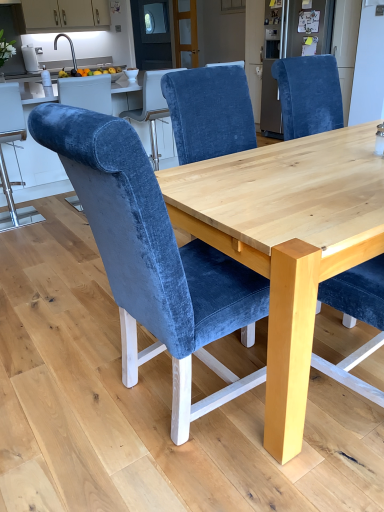
Question: Is velvet blue chair at left, which appears as the 1th chair when viewed from the left, inside velvet blue chair at center, arranged as the second chair when viewed from the right?

Choices:
 (A) no
 (B) yes

Answer: (A)

Question: From a real-world perspective, is velvet blue chair at center, which is the second chair in left-to-right order, under velvet blue chair at left, which is the 1th chair in back-to-front order?

Choices:
 (A) yes
 (B) no

Answer: (B)

Question: Does velvet blue chair at center, arranged as the second chair when viewed from the right, have a smaller size compared to velvet blue chair at left, which appears as the 1th chair when viewed from the left?

Choices:
 (A) no
 (B) yes

Answer: (A)

Question: Is velvet blue chair at center, which is counted as the first chair, starting from the front, facing away from velvet blue chair at left, acting as the third chair starting from the front?

Choices:
 (A) no
 (B) yes

Answer: (A)

Question: Does velvet blue chair at center, arranged as the second chair when viewed from the right, have a greater height compared to velvet blue chair at left, which ranks as the 3th chair in right-to-left order?

Choices:
 (A) no
 (B) yes

Answer: (B)

Question: Does point (205, 91) appear closer or farther from the camera than point (342, 44)?

Choices:
 (A) closer
 (B) farther

Answer: (A)

Question: Is velvet blue chair at center, which is the 2th chair in back-to-front order, wider or thinner than velvet blue chair at upper right?

Choices:
 (A) wide
 (B) thin

Answer: (B)

Question: Is velvet blue chair at center, the second chair positioned from the front, spatially inside velvet blue chair at upper right, or outside of it?

Choices:
 (A) outside
 (B) inside

Answer: (A)

Question: Based on their sizes in the image, would you say velvet blue chair at center, the second chair positioned from the front, is bigger or smaller than velvet blue chair at upper right?

Choices:
 (A) small
 (B) big

Answer: (A)

Question: From a real-world perspective, is velvet blue chair at center, the 3th chair in the left-to-right sequence, physically located above or below matte white cabinets at upper left?

Choices:
 (A) above
 (B) below

Answer: (B)

Question: Looking at the image, does velvet blue chair at center, the 3th chair in the left-to-right sequence, seem bigger or smaller compared to matte white cabinets at upper left?

Choices:
 (A) big
 (B) small

Answer: (A)

Question: Considering their positions, is velvet blue chair at center, arranged as the 1th chair when viewed from the right, located in front of or behind matte white cabinets at upper left?

Choices:
 (A) behind
 (B) front

Answer: (B)

Question: In terms of height, does velvet blue chair at center, the 3th chair in the left-to-right sequence, look taller or shorter compared to matte white cabinets at upper left?

Choices:
 (A) tall
 (B) short

Answer: (A)

Question: Considering the positions of point (253, 202) and point (13, 106), is point (253, 202) closer or farther from the camera than point (13, 106)?

Choices:
 (A) farther
 (B) closer

Answer: (B)

Question: From the image's perspective, is natural wood table at center positioned above or below velvet blue chair at left, which appears as the 1th chair when viewed from the left?

Choices:
 (A) below
 (B) above

Answer: (A)